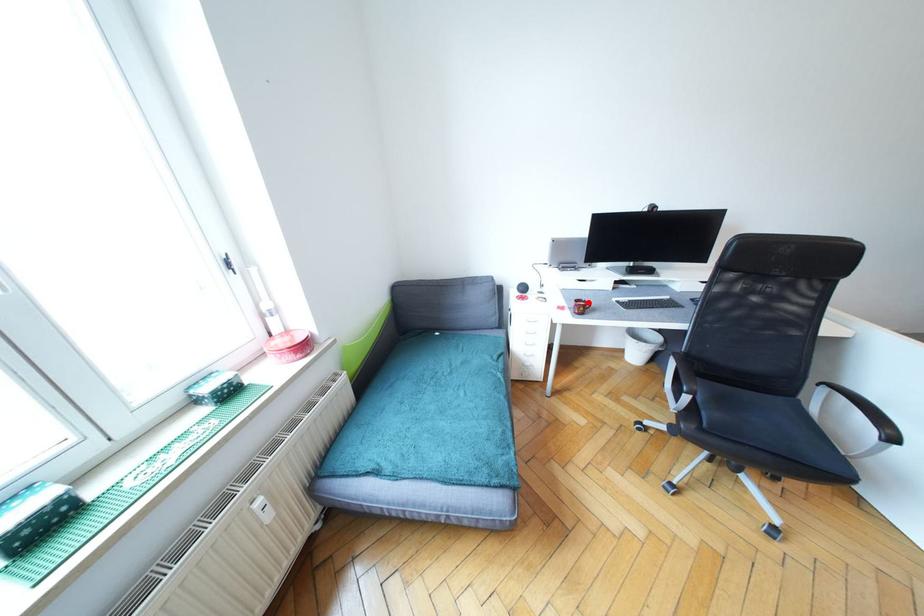
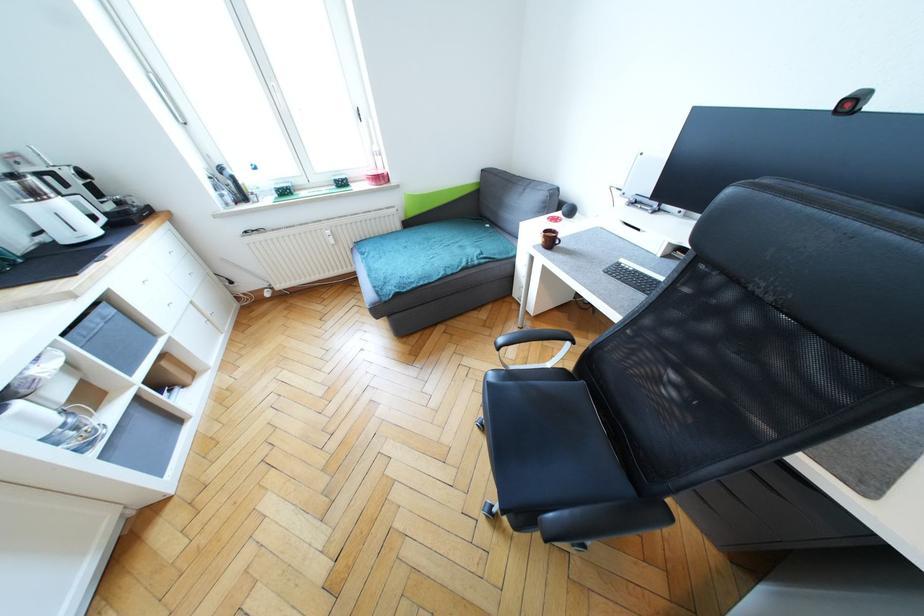
The point at the highlighted location is marked in the first image. Where is the corresponding point in the second image?

(558, 235)